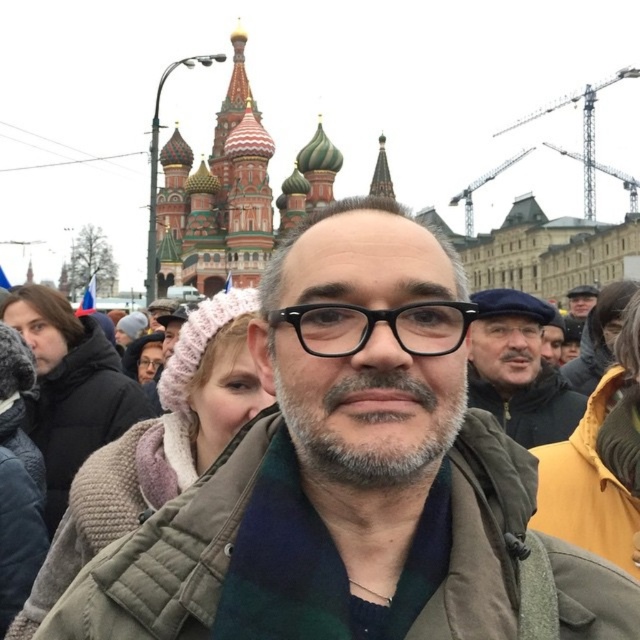
You are a photographer standing in Red Square and want to take a photo of the gray matte beard at center and the dark gray knit hat at upper left. Which object should you focus on first to ensure both are in clear focus?

You should focus on the gray matte beard at center first because it is closer to the viewer than the dark gray knit hat at upper left, so adjusting focus from near to far will help both be in clear focus.

You are a photographer trying to capture a detailed shot of both the green plaid scarf at center and the dark gray knit hat at upper left. Given their sizes, which one might require you to zoom in more to ensure clarity?

The dark gray knit hat at upper left requires more zooming in because it is smaller than the green plaid scarf at center.